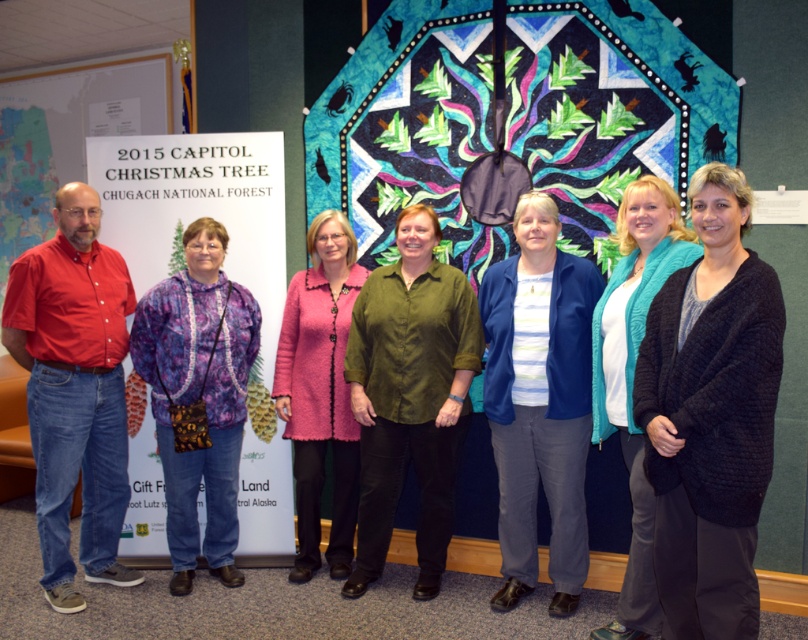
You are organizing a clothing donation drive and need to determine which of the two items, the black knitted cardigan at center or the pink textured coat at center, can fit into a standard donation box that accommodates items up to the size of the larger of the two. Which item should you choose?

The black knitted cardigan at center is bigger than the pink textured coat at center, so you should choose the black knitted cardigan at center to fit into the donation box since it is the larger item.

You are standing in front of the group of people posing for the photo. There are two points marked in the image. The first point is at coordinate (x=701, y=369) and the second point is at coordinate (x=343, y=502). Which point is closer to you?

Point (x=701, y=369) is closer to the viewer than point (x=343, y=502).